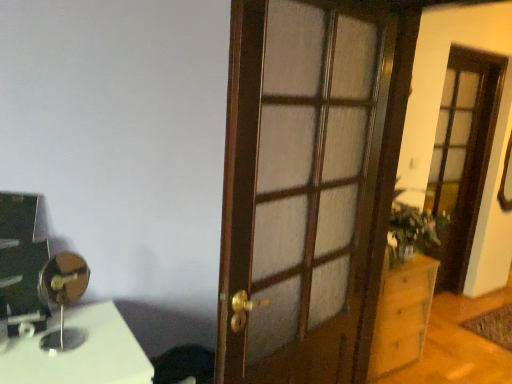
Question: Does wooden cabinet at right have a greater height compared to metallic gold table lamp at left?

Choices:
 (A) no
 (B) yes

Answer: (B)

Question: Is wooden cabinet at right smaller than metallic gold table lamp at left?

Choices:
 (A) no
 (B) yes

Answer: (A)

Question: From a real-world perspective, does wooden cabinet at right stand above metallic gold table lamp at left?

Choices:
 (A) no
 (B) yes

Answer: (A)

Question: Is wooden cabinet at right bigger than metallic gold table lamp at left?

Choices:
 (A) no
 (B) yes

Answer: (B)

Question: From the image's perspective, is wooden cabinet at right under metallic gold table lamp at left?

Choices:
 (A) no
 (B) yes

Answer: (B)

Question: From the image's perspective, is wooden cabinet at right over metallic gold table lamp at left?

Choices:
 (A) no
 (B) yes

Answer: (A)

Question: Is metallic gold table lamp at left to the right of wooden door at center from the viewer's perspective?

Choices:
 (A) yes
 (B) no

Answer: (B)

Question: Would you say wooden door at center is part of metallic gold table lamp at left's contents?

Choices:
 (A) no
 (B) yes

Answer: (A)

Question: Is metallic gold table lamp at left facing away from wooden door at center?

Choices:
 (A) yes
 (B) no

Answer: (B)

Question: Can you confirm if metallic gold table lamp at left is thinner than wooden door at center?

Choices:
 (A) yes
 (B) no

Answer: (B)

Question: Is metallic gold table lamp at left far from wooden door at center?

Choices:
 (A) no
 (B) yes

Answer: (A)

Question: From a real-world perspective, is metallic gold table lamp at left physically above wooden door at center?

Choices:
 (A) no
 (B) yes

Answer: (A)

Question: From a real-world perspective, is green leafy plant at right beneath wooden cabinet at right?

Choices:
 (A) no
 (B) yes

Answer: (A)